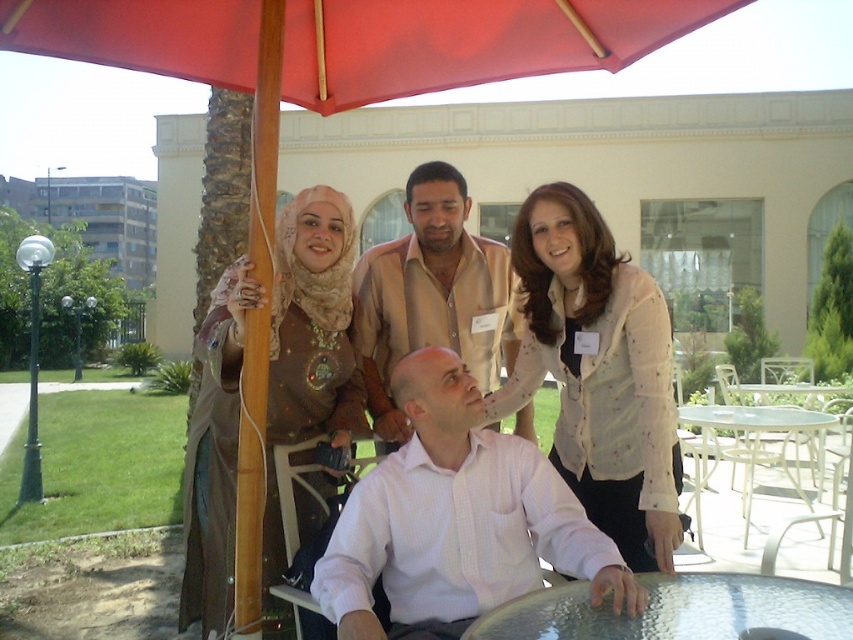
Does matte beige hijab at upper left appear under white metal table at lower right?

Actually, matte beige hijab at upper left is above white metal table at lower right.

Can you confirm if matte beige hijab at upper left is shorter than white metal table at lower right?

No.

Is point (347, 228) less distant than point (793, 461)?

Yes.

You are a GUI agent. You are given a task and a screenshot of the screen. Output one action in this format:
    pyautogui.click(x=<x>, y=<y>)
    Task: Click on the matte beige hijab at upper left
    
    Given the screenshot: What is the action you would take?
    pyautogui.click(x=310, y=340)

Which is more to the right, red fabric umbrella at upper center or matte beige hijab at upper left?

red fabric umbrella at upper center

Locate an element on the screen. The image size is (853, 640). red fabric umbrella at upper center is located at coordinates (352, 40).

Is matte beige hijab at upper left in front of white painted wood chair at lower right?

Yes, it is in front of white painted wood chair at lower right.

The width and height of the screenshot is (853, 640). Describe the element at coordinates (310, 340) in the screenshot. I see `matte beige hijab at upper left` at that location.

Locate an element on the screen. The width and height of the screenshot is (853, 640). matte beige hijab at upper left is located at coordinates (310, 340).